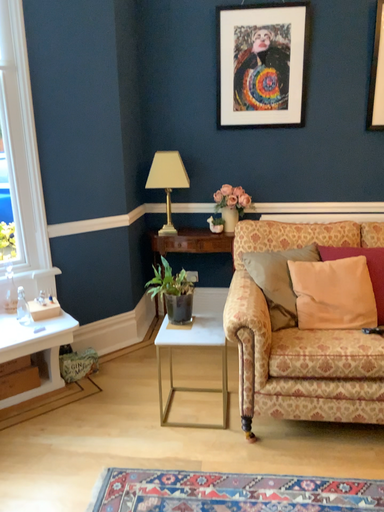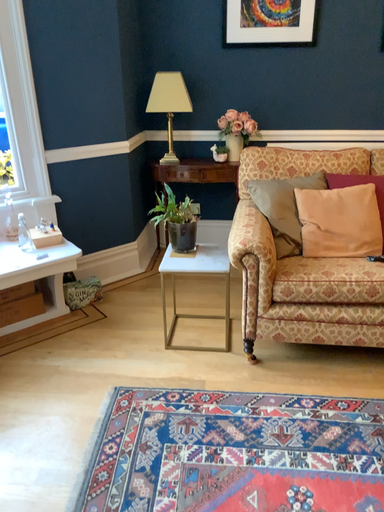
Question: How did the camera likely rotate when shooting the video?

Choices:
 (A) rotated upward
 (B) rotated downward

Answer: (B)